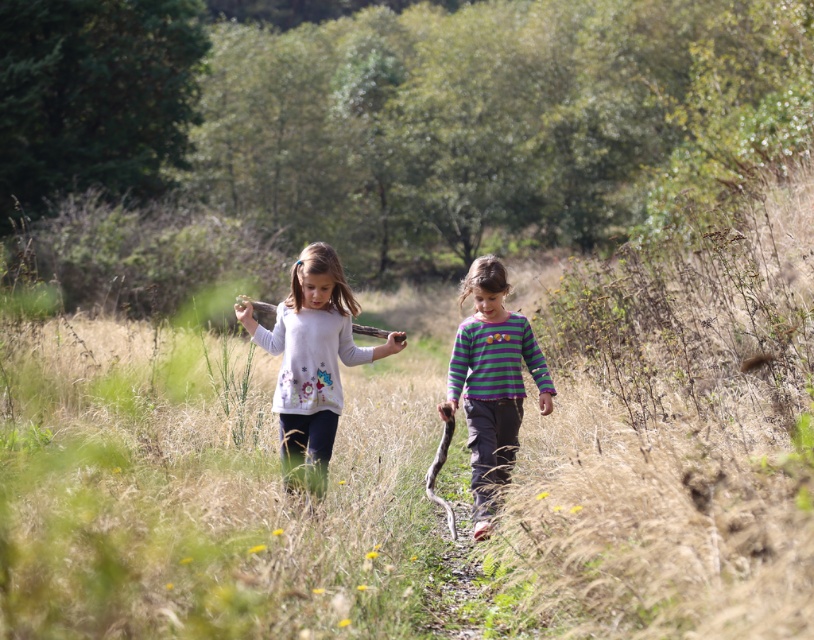
Question: Which of the following is the closest to the observer?

Choices:
 (A) pos(392,348)
 (B) pos(515,333)

Answer: (A)

Question: Which point is closer to the camera?

Choices:
 (A) striped cotton shirt at center
 (B) white matte sweater at center

Answer: (B)

Question: Does white matte sweater at center appear over striped cotton shirt at center?

Choices:
 (A) yes
 (B) no

Answer: (A)

Question: Is the position of white matte sweater at center more distant than that of striped cotton shirt at center?

Choices:
 (A) no
 (B) yes

Answer: (A)

Question: Is white matte sweater at center above striped cotton shirt at center?

Choices:
 (A) yes
 (B) no

Answer: (A)